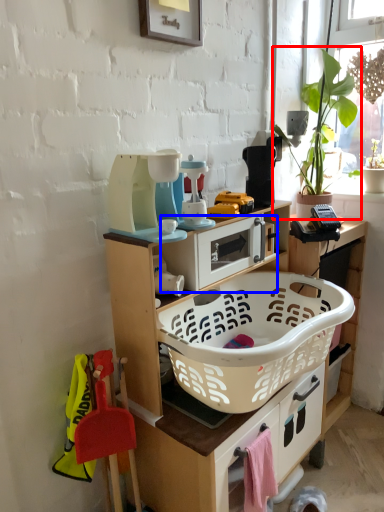
Question: Which point is further to the camera, houseplant (highlighted by a red box) or appliance (highlighted by a blue box)?

Choices:
 (A) houseplant
 (B) appliance

Answer: (A)